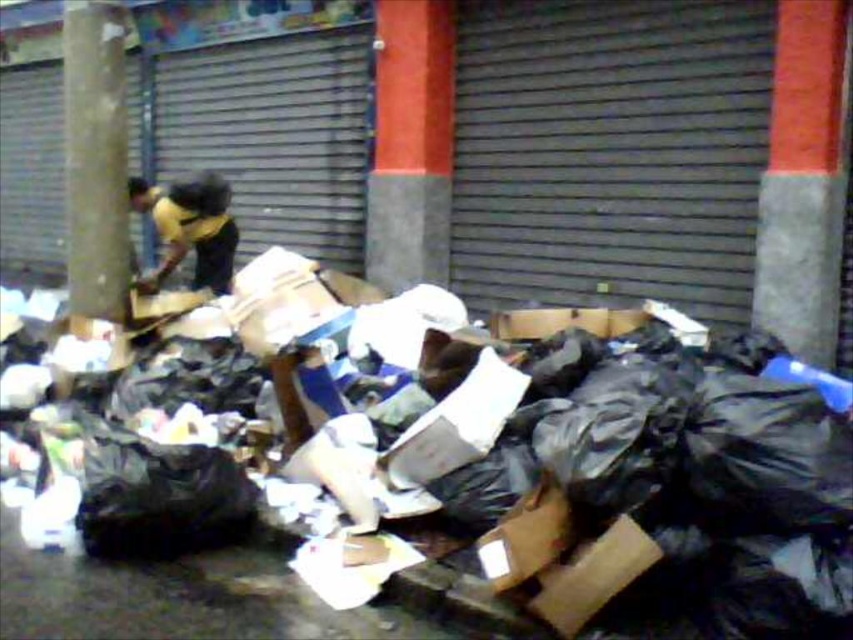
Does red concrete pillar at center right lie behind red concrete pillar at center?

No, it is in front of red concrete pillar at center.

Is point (761, 246) less distant than point (415, 77)?

Yes, point (761, 246) is in front of point (415, 77).

Find the location of a particular element. The width and height of the screenshot is (853, 640). red concrete pillar at center right is located at coordinates (804, 180).

Based on the photo, can you confirm if red concrete pillar at center right is positioned to the right of yellow jersey at center?

Correct, you'll find red concrete pillar at center right to the right of yellow jersey at center.

Can you confirm if red concrete pillar at center right is thinner than yellow jersey at center?

Indeed, red concrete pillar at center right has a lesser width compared to yellow jersey at center.

This screenshot has height=640, width=853. What do you see at coordinates (804, 180) in the screenshot? I see `red concrete pillar at center right` at bounding box center [804, 180].

Find the location of a particular element. red concrete pillar at center right is located at coordinates (804, 180).

The width and height of the screenshot is (853, 640). Describe the element at coordinates (410, 144) in the screenshot. I see `red concrete pillar at center` at that location.

Is the position of red concrete pillar at center less distant than that of smooth concrete pillar at left?

No, it is not.

Describe the element at coordinates (410, 144) in the screenshot. I see `red concrete pillar at center` at that location.

The height and width of the screenshot is (640, 853). I want to click on red concrete pillar at center, so click(410, 144).